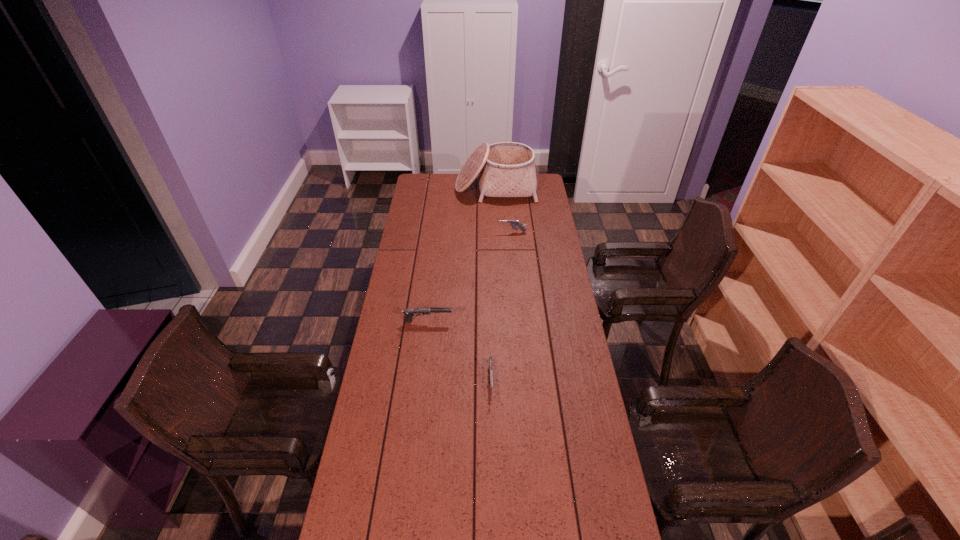
This screenshot has height=540, width=960. In order to click on vacant space situated 0.390m at the barrel of the farthest gun in this screenshot , I will do tap(421, 232).

The height and width of the screenshot is (540, 960). I want to click on vacant region located 0.240m at the barrel of the farthest gun, so click(x=450, y=232).

The image size is (960, 540). Find the location of `free location located 0.240m at the barrel of the farthest gun`. free location located 0.240m at the barrel of the farthest gun is located at coordinates (450, 232).

Locate an element on the screen. The height and width of the screenshot is (540, 960). vacant region located aimed along the barrel of the nearest gun is located at coordinates (492, 419).

Locate an element on the screen. This screenshot has height=540, width=960. object that is at the far edge is located at coordinates (506, 169).

This screenshot has width=960, height=540. I want to click on object present at the left edge, so click(x=410, y=312).

I want to click on basket present at the right edge, so click(x=506, y=169).

Locate an element on the screen. gun at the right edge is located at coordinates (514, 223).

Locate an element on the screen. object that is positioned at the far right corner is located at coordinates (506, 169).

Identify the location of free space at the left edge of the desktop. (400, 495).